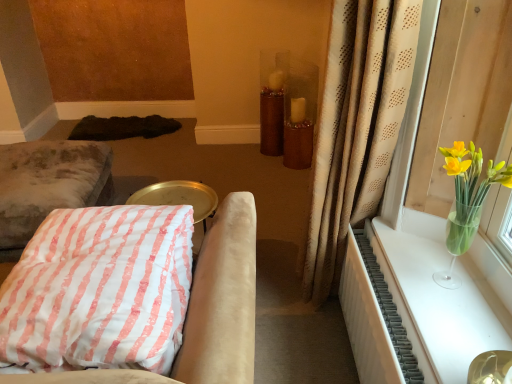
Locate an element on the screen. This screenshot has width=512, height=384. vacant space positioned to the left of translucent glass vase at upper right is located at coordinates (404, 282).